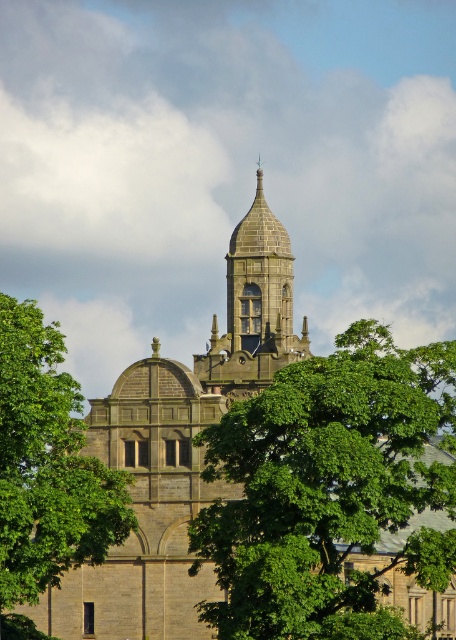
Between green leafy tree at center and green leafy tree at left, which one has less height?

Standing shorter between the two is green leafy tree at center.

How far apart are green leafy tree at center and green leafy tree at left?

green leafy tree at center and green leafy tree at left are 11.81 meters apart.

Does point (425, 548) come in front of point (58, 544)?

That is False.

Image resolution: width=456 pixels, height=640 pixels. I want to click on green leafy tree at center, so click(x=327, y=488).

Which is above, green leafy tree at left or stone steeple at center?

stone steeple at center

Can you confirm if green leafy tree at left is taller than stone steeple at center?

Correct, green leafy tree at left is much taller as stone steeple at center.

Who is more forward, (79, 520) or (265, 228)?

Point (79, 520) is in front.

Find the location of a particular element. The height and width of the screenshot is (640, 456). green leafy tree at left is located at coordinates (46, 470).

Does green leafy tree at center appear on the left side of stone steeple at center?

Incorrect, green leafy tree at center is not on the left side of stone steeple at center.

Is green leafy tree at center above stone steeple at center?

Incorrect, green leafy tree at center is not positioned above stone steeple at center.

The image size is (456, 640). I want to click on green leafy tree at center, so click(x=327, y=488).

This screenshot has width=456, height=640. Identify the location of green leafy tree at center. (327, 488).